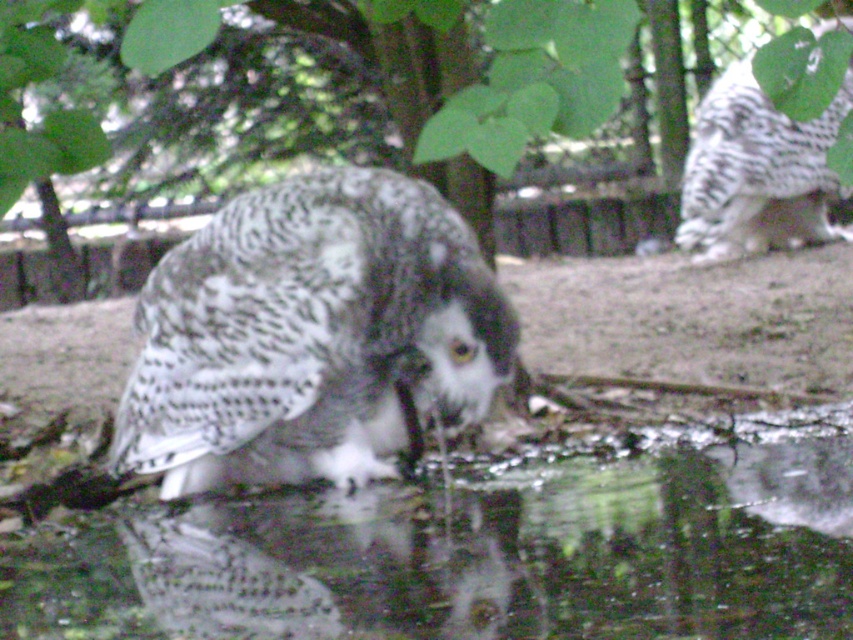
Question: Among these points, which one is nearest to the camera?

Choices:
 (A) (315, 461)
 (B) (506, 52)
 (C) (242, 605)

Answer: (B)

Question: Estimate the real-world distances between objects in this image. Which object is farther from the white speckled owl at upper right?

Choices:
 (A) speckled feathered owl at center
 (B) green leafy tree at center
 (C) clear water at lower center

Answer: (B)

Question: Can you confirm if clear water at lower center is smaller than speckled feathered owl at center?

Choices:
 (A) yes
 (B) no

Answer: (B)

Question: Which point is closer to the camera?

Choices:
 (A) clear water at lower center
 (B) green leafy tree at center
 (C) white speckled owl at upper right

Answer: (A)

Question: Considering the relative positions of speckled feathered owl at center and white speckled owl at upper right in the image provided, where is speckled feathered owl at center located with respect to white speckled owl at upper right?

Choices:
 (A) left
 (B) right

Answer: (A)

Question: Is speckled feathered owl at center above green leafy tree at center?

Choices:
 (A) yes
 (B) no

Answer: (B)